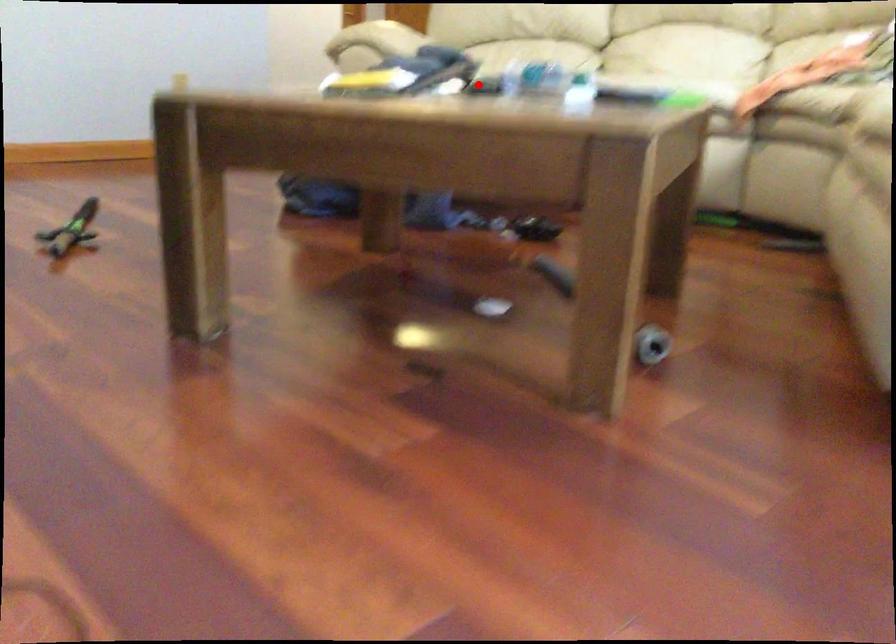
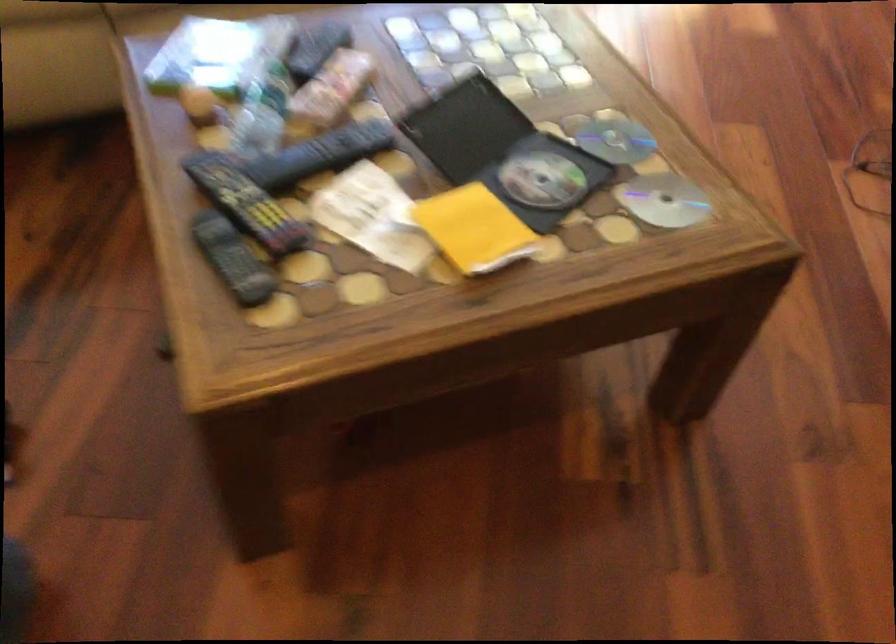
The point at the highlighted location is marked in the first image. Where is the corresponding point in the second image?

(320, 154)